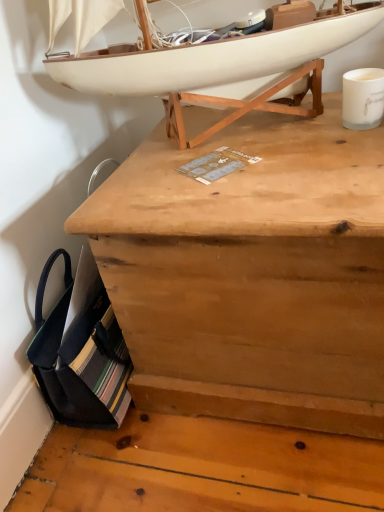
Where is `free space in front of white matte coffee cup at upper right`? free space in front of white matte coffee cup at upper right is located at coordinates (350, 158).